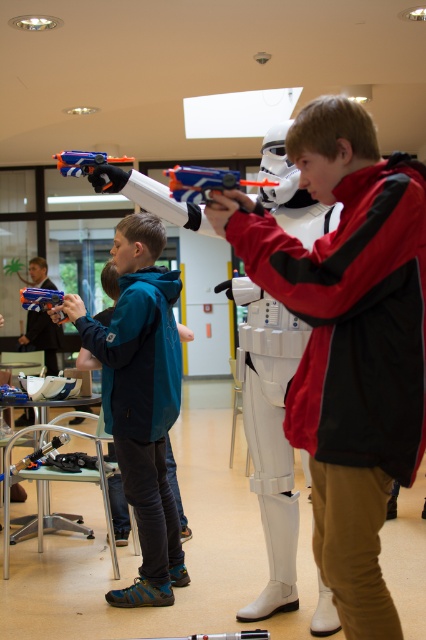
Question: Is matte black jacket at center wider than teal fabric jacket at center?

Choices:
 (A) no
 (B) yes

Answer: (A)

Question: Which point is farther to the camera?

Choices:
 (A) (48, 301)
 (B) (166, 294)
 (C) (373, 332)

Answer: (A)

Question: Which is farther from the matte blue toy gun at center?

Choices:
 (A) teal fabric jacket at center
 (B) matte black jacket at center

Answer: (B)

Question: Does matte black jacket at center appear on the left side of matte blue toy gun at center?

Choices:
 (A) no
 (B) yes

Answer: (A)

Question: Is matte black jacket at center below matte blue toy gun at center?

Choices:
 (A) no
 (B) yes

Answer: (B)

Question: Which of these objects is positioned farthest from the matte blue toy gun at center?

Choices:
 (A) teal fabric jacket at center
 (B) matte black jacket at center

Answer: (B)